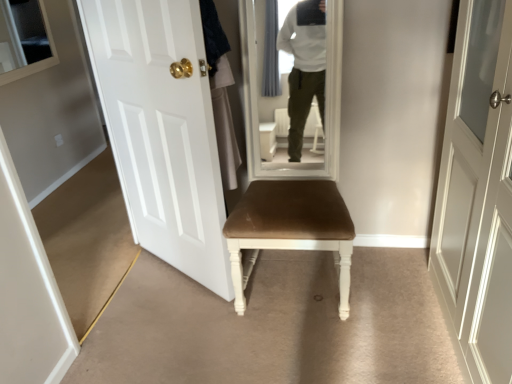
Locate an element on the screen. The height and width of the screenshot is (384, 512). vacant area that lies to the right of brown velvet chair at center is located at coordinates (390, 286).